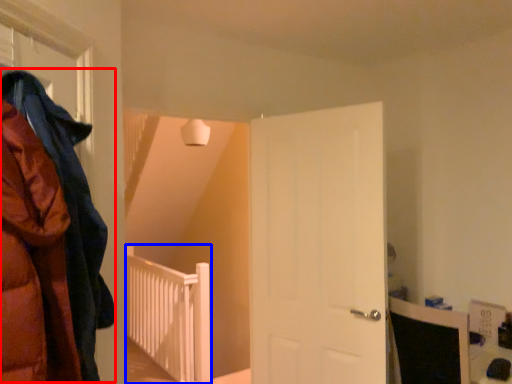
Question: Which of the following is the closest to the observer, cloak (highlighted by a red box) or rail (highlighted by a blue box)?

Choices:
 (A) cloak
 (B) rail

Answer: (A)